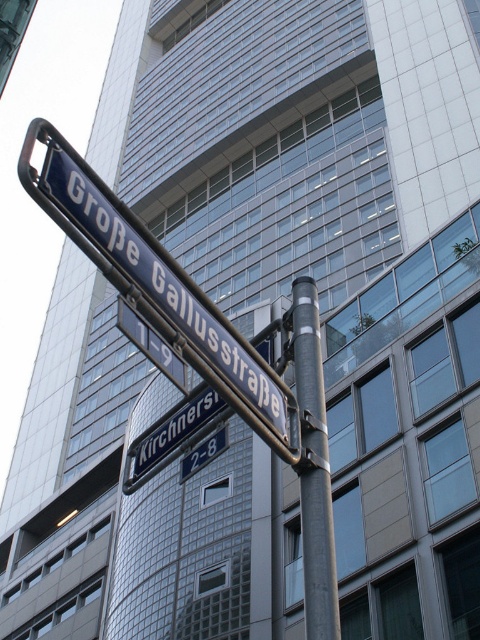
Which of these two, metallic blue street sign at center or metallic gray pole at center, stands taller?

metallic blue street sign at center is taller.

Can you confirm if metallic blue street sign at center is taller than metallic gray pole at center?

Yes.

Does point (271, 380) come behind point (335, 634)?

Yes, it is.

Locate an element on the screen. Image resolution: width=480 pixels, height=640 pixels. metallic blue street sign at center is located at coordinates (157, 288).